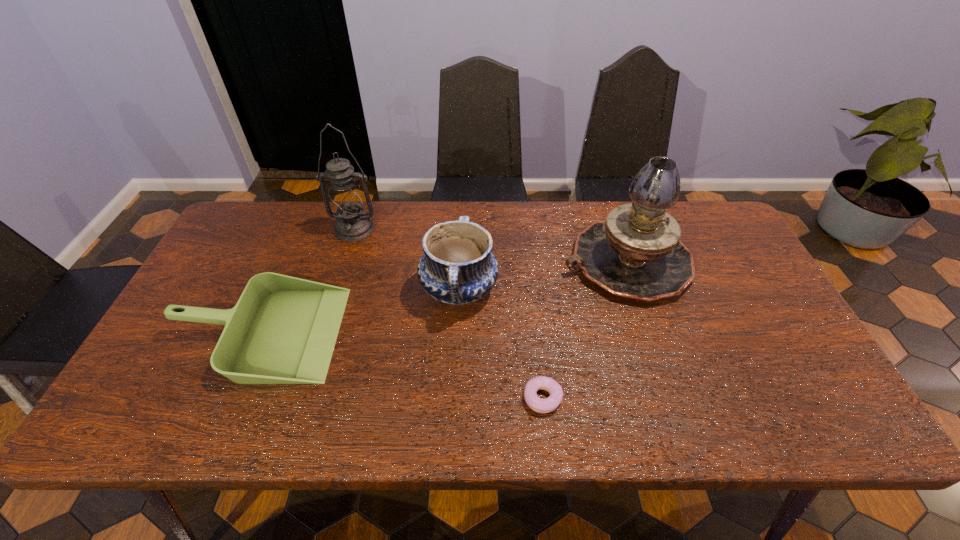
Where is `vacant region that satisfies the following two spatial constraints: 1. on the front side of the third object from right to left; 2. on the right side of the doughnut`? vacant region that satisfies the following two spatial constraints: 1. on the front side of the third object from right to left; 2. on the right side of the doughnut is located at coordinates (454, 398).